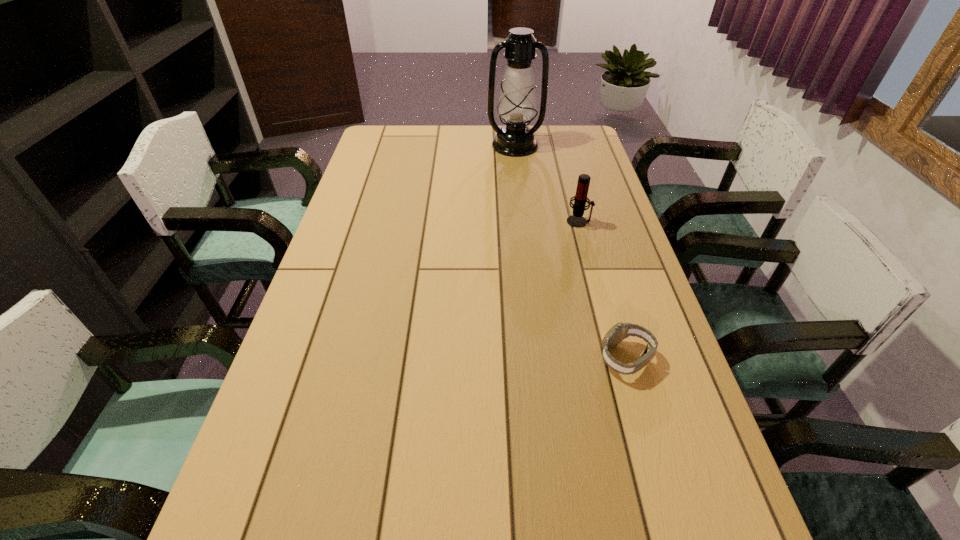
The height and width of the screenshot is (540, 960). In order to click on vacant area situated on the face of the watch in this screenshot , I will do `click(467, 358)`.

Where is `object that is at the far edge`? object that is at the far edge is located at coordinates (517, 104).

In order to click on microphone that is at the right edge in this screenshot , I will do `click(576, 220)`.

Where is `watch that is at the right edge`? This screenshot has height=540, width=960. watch that is at the right edge is located at coordinates (620, 331).

Where is `vacant space at the far edge of the desktop`? vacant space at the far edge of the desktop is located at coordinates (492, 135).

The height and width of the screenshot is (540, 960). I want to click on free space at the left edge of the desktop, so click(x=366, y=211).

I want to click on free region at the right edge of the desktop, so click(600, 193).

At what (x,y) coordinates should I click in order to perform the action: click on vacant region between the second farthest object and the shortest object. Please return your answer as a coordinate pair (x, y). This screenshot has height=540, width=960. Looking at the image, I should click on (603, 290).

What are the coordinates of `vacant space that's between the oil lamp and the microphone` in the screenshot? It's located at (547, 184).

Locate an element on the screen. This screenshot has width=960, height=540. unoccupied area between the second farthest object and the tallest object is located at coordinates (547, 184).